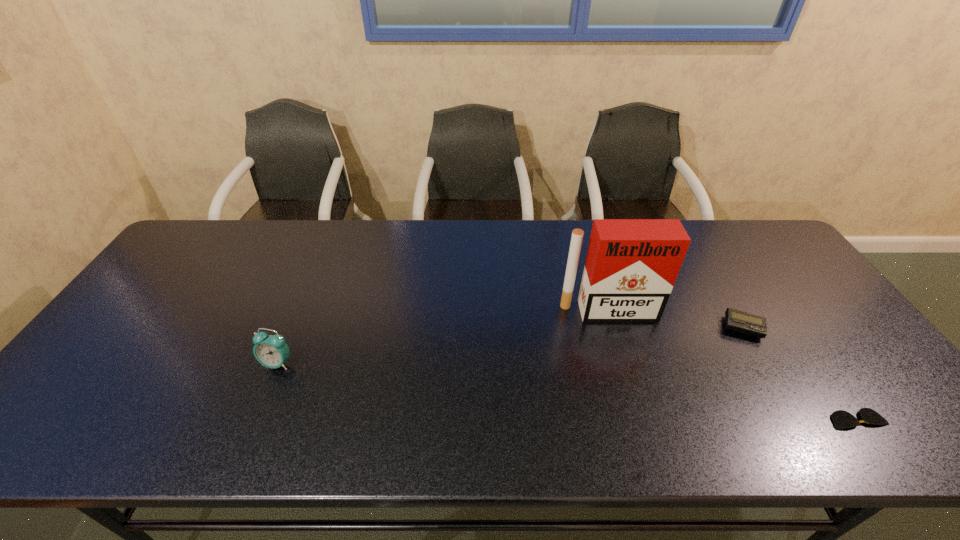
You are a GUI agent. You are given a task and a screenshot of the screen. Output one action in this format:
    pyautogui.click(x=<x>, y=<y>)
    Task: Click on the cigarette case
    The height and width of the screenshot is (540, 960).
    Given the screenshot: What is the action you would take?
    pyautogui.click(x=631, y=266)

Locate an element on the screen. the tallest object is located at coordinates (631, 266).

I want to click on the second nearest object, so click(x=271, y=351).

In order to click on the leftmost object in this screenshot , I will do `click(271, 351)`.

The image size is (960, 540). In order to click on the third tallest object in this screenshot , I will do `click(735, 320)`.

Where is `the third object from left to right`? Image resolution: width=960 pixels, height=540 pixels. the third object from left to right is located at coordinates (735, 320).

Locate an element on the screen. The height and width of the screenshot is (540, 960). spectacles is located at coordinates (842, 419).

Identify the location of the shortest object. (842, 419).

Find the location of a particular element. The height and width of the screenshot is (540, 960). free spot located on the front-facing side of the third object from right to left is located at coordinates (625, 367).

This screenshot has height=540, width=960. I want to click on vacant space positioned on the face of the second nearest object, so click(x=267, y=390).